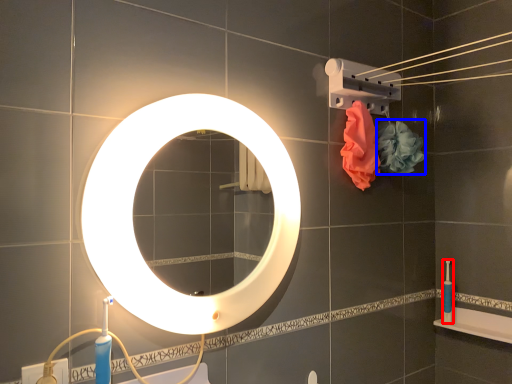
Question: Which object is closer to the camera taking this photo, toiletry (highlighted by a red box) or flower (highlighted by a blue box)?

Choices:
 (A) toiletry
 (B) flower

Answer: (B)